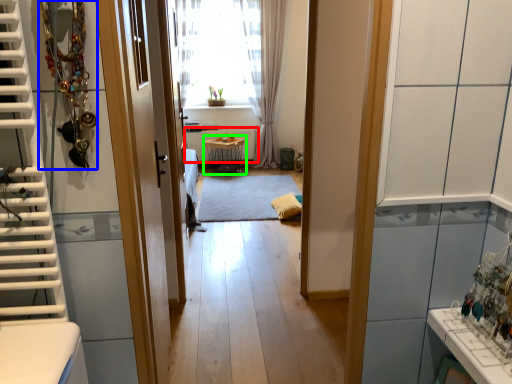
Question: Estimate the real-world distances between objects in this image. Which object is farther from radiator (highlighted by a red box), necklace (highlighted by a blue box) or table (highlighted by a green box)?

Choices:
 (A) necklace
 (B) table

Answer: (A)